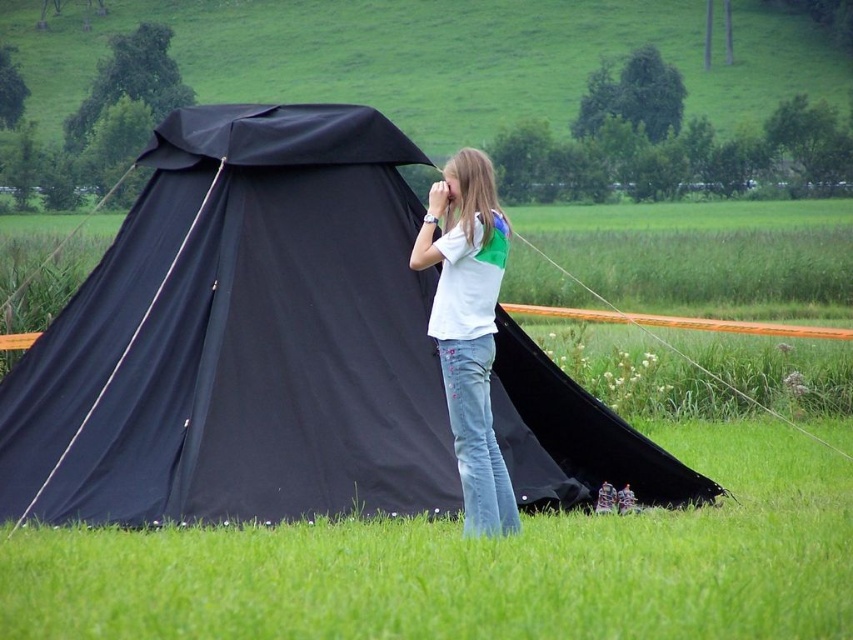
Does black fabric tent at center have a greater height compared to white cotton shirt at center?

Yes, black fabric tent at center is taller than white cotton shirt at center.

This screenshot has width=853, height=640. Identify the location of black fabric tent at center. coord(242,337).